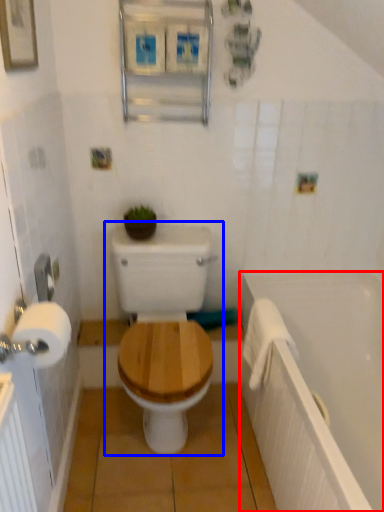
Question: Which object is closer to the camera taking this photo, bath (highlighted by a red box) or toilet (highlighted by a blue box)?

Choices:
 (A) bath
 (B) toilet

Answer: (A)